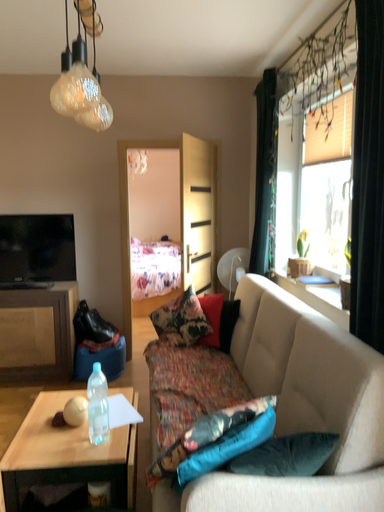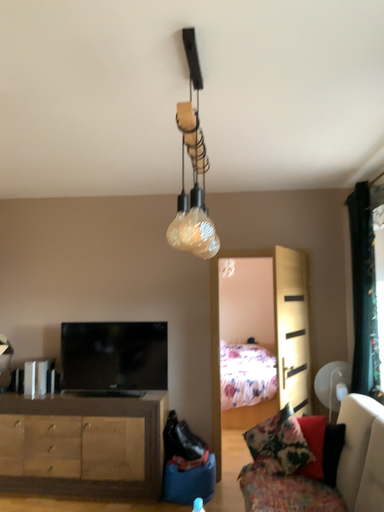
Question: Which way did the camera rotate in the video?

Choices:
 (A) rotated downward
 (B) rotated upward

Answer: (B)